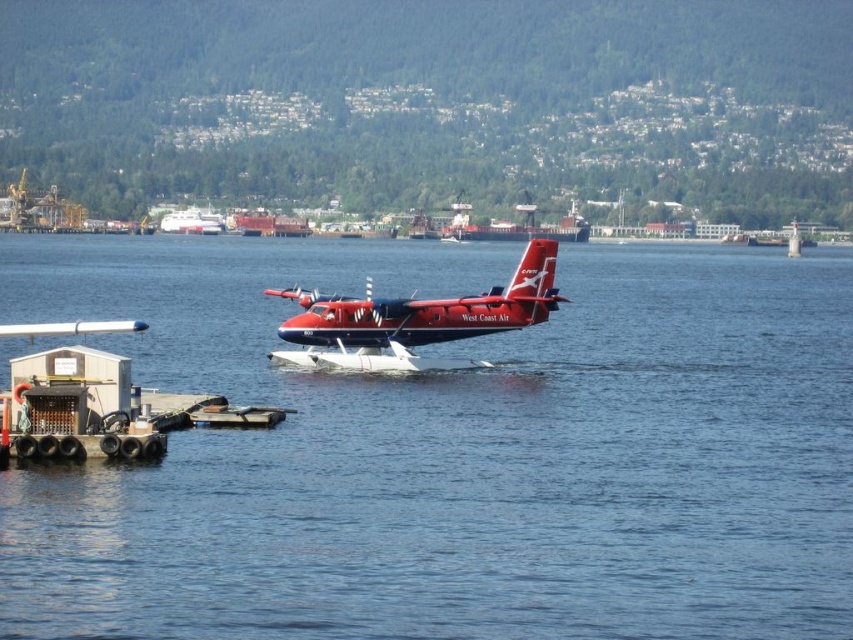
You are standing at the dock and want to reach the seaplane. The point you need to reach is at coordinates point (160, 339). If your maximum walking distance is 50 meters, can you reach it without swimming?

The distance of point (160, 339) from camera is 59.81 meters, so you cannot reach it within 50 meters without swimming.

You are a pilot planning to dock a seaplane at the center of the water. The coordinates for the center are given as point 0.502, 0.487. Is the matte red seaplane at center currently occupying that position?

Yes, the matte red seaplane at center is currently occupying the position at point (415, 321).